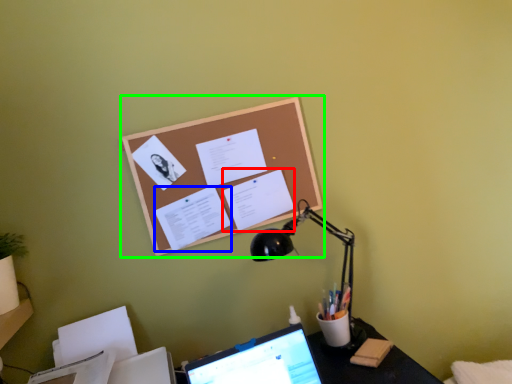
Question: Which is nearer to the document (highlighted by a red box)? document (highlighted by a blue box) or bulletin board (highlighted by a green box).

Choices:
 (A) document
 (B) bulletin board

Answer: (B)